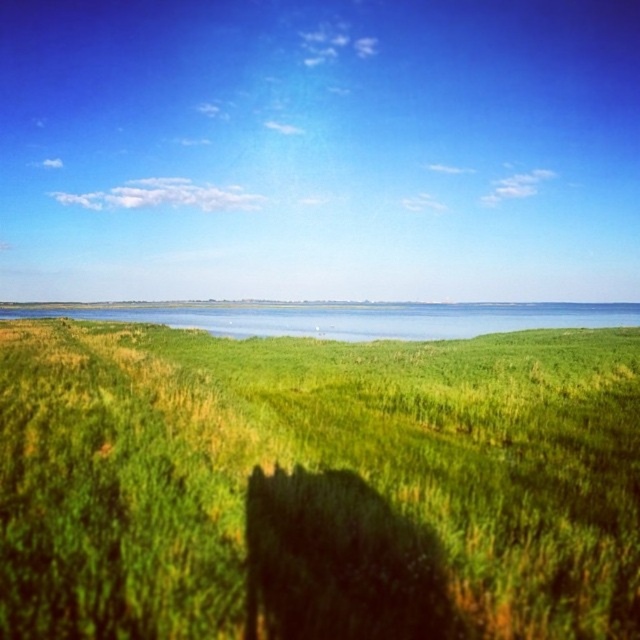
Question: Where is green grassy field at center located in relation to blue water at center in the image?

Choices:
 (A) right
 (B) left

Answer: (B)

Question: Is green grassy field at center smaller than blue water at center?

Choices:
 (A) no
 (B) yes

Answer: (B)

Question: Is green grassy field at center bigger than blue water at center?

Choices:
 (A) yes
 (B) no

Answer: (B)

Question: Which of the following is the farthest from the observer?

Choices:
 (A) blue water at center
 (B) green grassy field at center

Answer: (A)